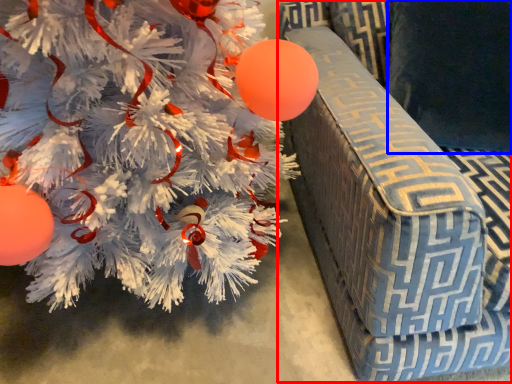
Question: Which point is closer to the camera, armchair (highlighted by a red box) or pillow (highlighted by a blue box)?

Choices:
 (A) armchair
 (B) pillow

Answer: (A)